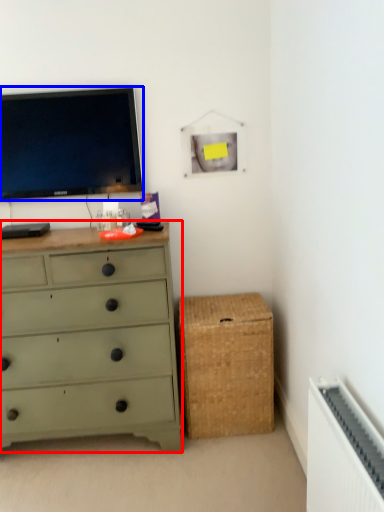
Question: Which object is closer to the camera taking this photo, chest of drawers (highlighted by a red box) or television (highlighted by a blue box)?

Choices:
 (A) chest of drawers
 (B) television

Answer: (A)